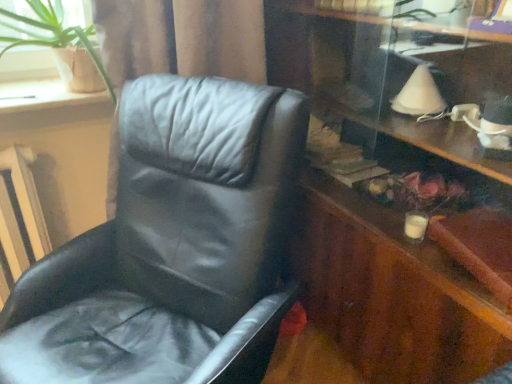
Question: Is black leather chair at left taller than green leafy plant at upper left?

Choices:
 (A) no
 (B) yes

Answer: (B)

Question: Does black leather chair at left come in front of green leafy plant at upper left?

Choices:
 (A) no
 (B) yes

Answer: (B)

Question: From a real-world perspective, does black leather chair at left stand above green leafy plant at upper left?

Choices:
 (A) yes
 (B) no

Answer: (B)

Question: From the image's perspective, is black leather chair at left located above green leafy plant at upper left?

Choices:
 (A) no
 (B) yes

Answer: (A)

Question: From a real-world perspective, is black leather chair at left physically below green leafy plant at upper left?

Choices:
 (A) no
 (B) yes

Answer: (B)

Question: Is white textured radiator at left spatially inside green leafy plant at upper left, or outside of it?

Choices:
 (A) outside
 (B) inside

Answer: (A)

Question: Is point (32, 221) closer or farther from the camera than point (79, 74)?

Choices:
 (A) closer
 (B) farther

Answer: (B)

Question: In terms of size, does white textured radiator at left appear bigger or smaller than green leafy plant at upper left?

Choices:
 (A) big
 (B) small

Answer: (B)

Question: Considering the positions of white textured radiator at left and green leafy plant at upper left in the image, is white textured radiator at left taller or shorter than green leafy plant at upper left?

Choices:
 (A) short
 (B) tall

Answer: (B)

Question: From the image's perspective, is black leather chair at left positioned above or below green leafy plant at upper left?

Choices:
 (A) above
 (B) below

Answer: (B)

Question: Is black leather chair at left bigger or smaller than green leafy plant at upper left?

Choices:
 (A) big
 (B) small

Answer: (A)

Question: In the image, is black leather chair at left on the left side or the right side of green leafy plant at upper left?

Choices:
 (A) left
 (B) right

Answer: (B)

Question: Is point (284, 248) positioned closer to the camera than point (97, 57)?

Choices:
 (A) closer
 (B) farther

Answer: (A)

Question: In terms of size, does white textured radiator at left appear bigger or smaller than black leather chair at left?

Choices:
 (A) big
 (B) small

Answer: (B)

Question: Relative to black leather chair at left, is white textured radiator at left in front or behind?

Choices:
 (A) front
 (B) behind

Answer: (B)